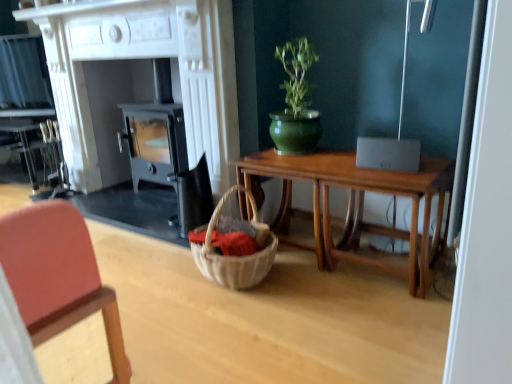
Describe the element at coordinates (357, 206) in the screenshot. This screenshot has height=384, width=512. I see `wooden table at center` at that location.

The width and height of the screenshot is (512, 384). I want to click on green glossy vase at upper center, so click(x=295, y=102).

Measure the distance between point (200,132) and camera.

Point (200,132) and camera are 7.89 feet apart from each other.

Find the location of `wooden table at center`. wooden table at center is located at coordinates (357, 206).

Between wooden table at center and green glossy vase at upper center, which one has more height?

green glossy vase at upper center is taller.

Which object is closer to the camera, wooden table at center or green glossy vase at upper center?

wooden table at center is more forward.

Can you confirm if wooden table at center is thinner than green glossy vase at upper center?

Incorrect, the width of wooden table at center is not less than that of green glossy vase at upper center.

How much distance is there between wooden table at center and green glossy vase at upper center?

wooden table at center is 15.56 inches from green glossy vase at upper center.

Are green glossy vase at upper center and wooden table at center located far from each other?

No, there isn't a large distance between green glossy vase at upper center and wooden table at center.

Does green glossy vase at upper center have a lesser width compared to wooden table at center?

Yes.

Between green glossy vase at upper center and wooden table at center, which one appears on the right side from the viewer's perspective?

From the viewer's perspective, wooden table at center appears more on the right side.

Which is nearer, (289, 42) or (281, 222)?

The point (289, 42) is closer to the camera.

Does white wood fireplace at center have a greater height compared to wooden table at center?

Yes, white wood fireplace at center is taller than wooden table at center.

Considering the relative positions of white wood fireplace at center and wooden table at center in the image provided, is white wood fireplace at center to the left of wooden table at center from the viewer's perspective?

Correct, you'll find white wood fireplace at center to the left of wooden table at center.

Considering the positions of objects white wood fireplace at center and wooden table at center in the image provided, who is behind, white wood fireplace at center or wooden table at center?

white wood fireplace at center is more distant.

Which point is more forward, (134, 188) or (296, 82)?

Point (296, 82)

Which is more to the left, white wood fireplace at center or green glossy vase at upper center?

From the viewer's perspective, white wood fireplace at center appears more on the left side.

What's the angular difference between white wood fireplace at center and green glossy vase at upper center's facing directions?

There is a 0.9-degree angle between the facing directions of white wood fireplace at center and green glossy vase at upper center.

Consider the image. Is white wood fireplace at center thinner than green glossy vase at upper center?

Incorrect, the width of white wood fireplace at center is not less than that of green glossy vase at upper center.

From the image's perspective, is green glossy vase at upper center located beneath white wood fireplace at center?

Correct, green glossy vase at upper center appears lower than white wood fireplace at center in the image.

You are a GUI agent. You are given a task and a screenshot of the screen. Output one action in this format:
    pyautogui.click(x=<x>, y=<y>)
    Task: Click on the houseplant behind the white wood fireplace at center
    The image size is (512, 384).
    Given the screenshot: What is the action you would take?
    pyautogui.click(x=295, y=102)

Looking at this image, from a real-world perspective, does green glossy vase at upper center sit lower than white wood fireplace at center?

No, from a real-world perspective, green glossy vase at upper center is not below white wood fireplace at center.

Considering the sizes of wooden table at center and white wood fireplace at center in the image, is wooden table at center taller or shorter than white wood fireplace at center?

In the image, wooden table at center appears to be shorter than white wood fireplace at center.

Is wooden table at center next to white wood fireplace at center and touching it?

No, wooden table at center is not making contact with white wood fireplace at center.

Which object is positioned more to the left, wooden table at center or white wood fireplace at center?

white wood fireplace at center.

From a real-world perspective, is wooden table at center below white wood fireplace at center?

Yes.

In the image, there is a green glossy vase at upper center. Where is `table below it (from the image's perspective)`? The width and height of the screenshot is (512, 384). table below it (from the image's perspective) is located at coordinates (357, 206).

The height and width of the screenshot is (384, 512). Find the location of `table that appears on the right of green glossy vase at upper center`. table that appears on the right of green glossy vase at upper center is located at coordinates (357, 206).

Which object lies nearer to the anchor point green glossy vase at upper center, wooden table at center or white wood fireplace at center?

wooden table at center lies closer to green glossy vase at upper center than the other object.

Based on their spatial positions, is white wood fireplace at center or green glossy vase at upper center further from wooden table at center?

white wood fireplace at center is positioned further to the anchor wooden table at center.

Considering their positions, is green glossy vase at upper center positioned closer to white wood fireplace at center than wooden table at center?

green glossy vase at upper center is positioned closer to the anchor white wood fireplace at center.

Considering their positions, is white wood fireplace at center positioned further to green glossy vase at upper center than wooden table at center?

white wood fireplace at center is positioned further to the anchor green glossy vase at upper center.

When comparing their distances from white wood fireplace at center, does wooden table at center or green glossy vase at upper center seem further?

wooden table at center lies further to white wood fireplace at center than the other object.

When comparing their distances from wooden table at center, does green glossy vase at upper center or white wood fireplace at center seem further?

Based on the image, white wood fireplace at center appears to be further to wooden table at center.

Identify the location of houseplant between white wood fireplace at center and wooden table at center from left to right. This screenshot has height=384, width=512. (295, 102).